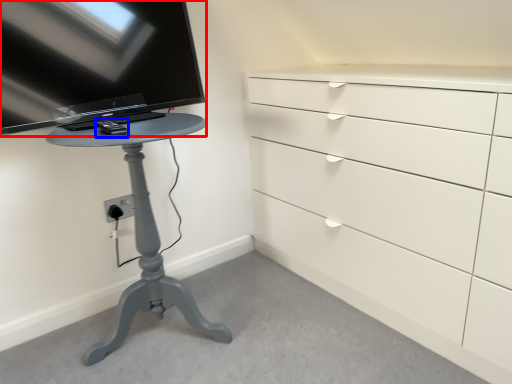
Question: Which point is further to the camera, television (highlighted by a red box) or equipment (highlighted by a blue box)?

Choices:
 (A) television
 (B) equipment

Answer: (B)